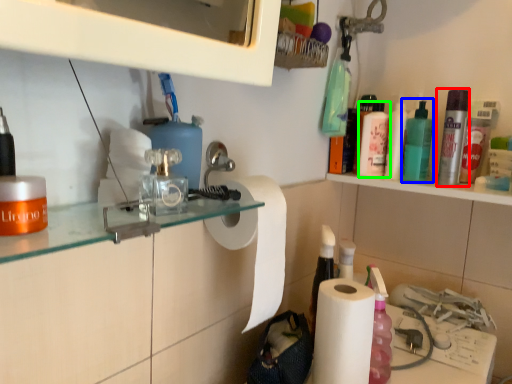
Question: Estimate the real-world distances between objects in this image. Which object is farther from mouthwash (highlighted by a red box), mouthwash (highlighted by a blue box) or mouthwash (highlighted by a green box)?

Choices:
 (A) mouthwash
 (B) mouthwash

Answer: (B)